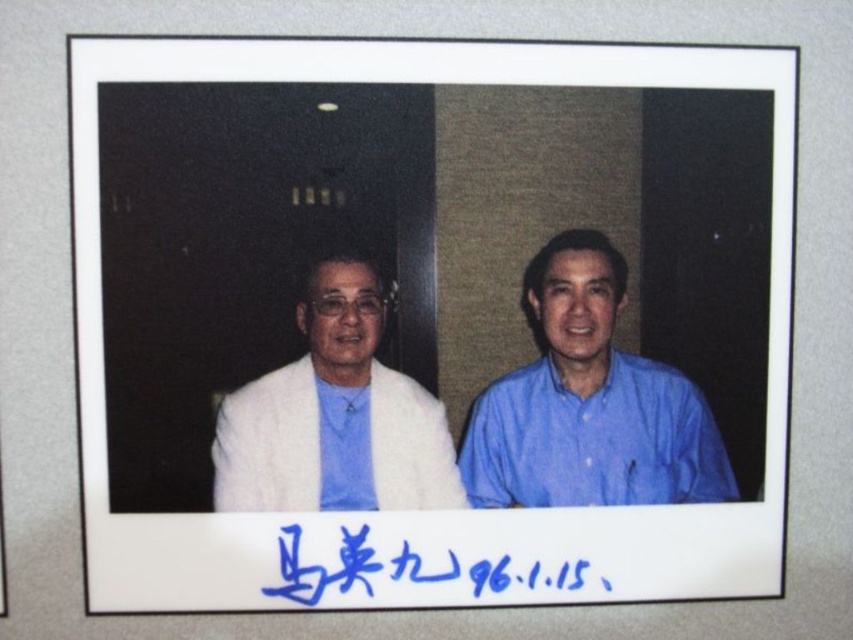
Question: Is white fur coat at left to the left of blue handwritten text at lower center from the viewer's perspective?

Choices:
 (A) no
 (B) yes

Answer: (B)

Question: Observing the image, what is the correct spatial positioning of blue cotton shirt at right in reference to blue fabric shirt at center?

Choices:
 (A) left
 (B) right

Answer: (B)

Question: Which point is closer to the camera taking this photo?

Choices:
 (A) (325, 428)
 (B) (323, 276)
 (C) (462, 577)

Answer: (B)

Question: Considering the relative positions of white fur coat at left and blue fabric shirt at center in the image provided, where is white fur coat at left located with respect to blue fabric shirt at center?

Choices:
 (A) right
 (B) left

Answer: (A)

Question: Estimate the real-world distances between objects in this image. Which object is closer to the blue cotton shirt at right?

Choices:
 (A) white fur coat at left
 (B) blue handwritten text at lower center
 (C) blue fabric shirt at center

Answer: (A)

Question: Which point appears closest to the camera in this image?

Choices:
 (A) (572, 310)
 (B) (339, 449)
 (C) (352, 486)
 (D) (390, 586)

Answer: (A)